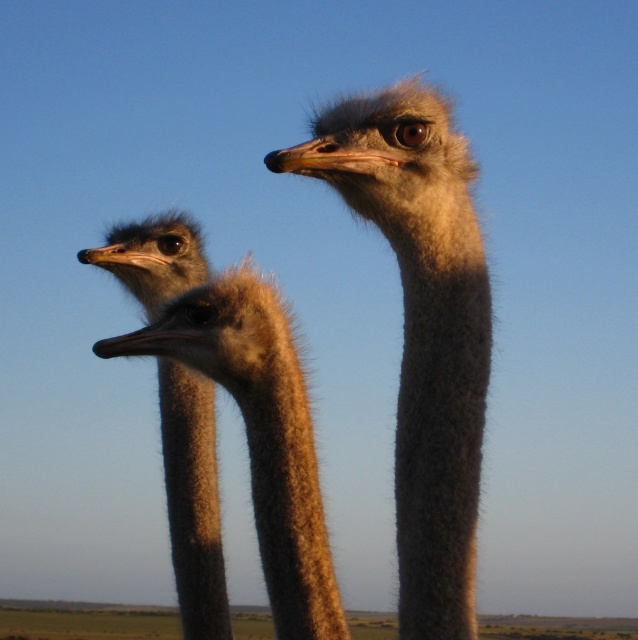
Question: Which point is farther from the camera taking this photo?

Choices:
 (A) (181, 284)
 (B) (302, 148)

Answer: (A)

Question: Does gray fluffy ostrich head at center have a greater width compared to brown fuzzy head at left?

Choices:
 (A) no
 (B) yes

Answer: (A)

Question: Observing the image, what is the correct spatial positioning of gray fluffy ostrich head at center in reference to brown fuzzy head at left?

Choices:
 (A) above
 (B) below

Answer: (A)

Question: Is gray fluffy ostrich head at center further to the viewer compared to brown fuzzy head at left?

Choices:
 (A) no
 (B) yes

Answer: (A)